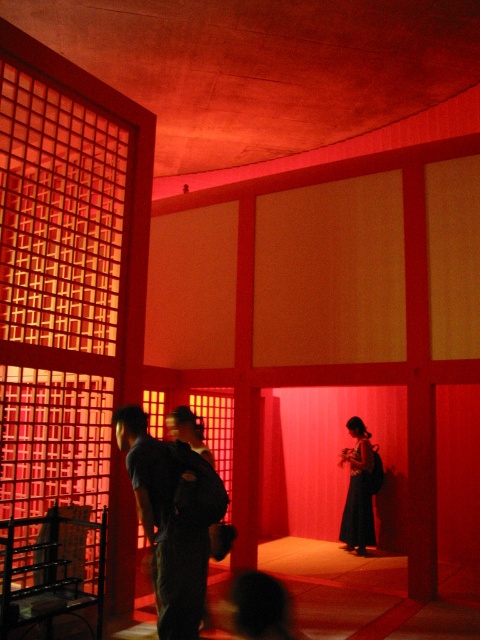
You are standing at the point labeled point (x=196, y=588). You want to walk straight to the sliding doors. How far will you have to walk?

The distance between the point labeled point (x=196, y=588) and the sliding doors is 3.32 meters, so you will have to walk 3.32 meters to reach the sliding doors.

You are organizing a small event in this red room and need to place both the dark blue fabric backpack at center and the black silk dress at center on a shelf. The shelf has limited space. Which object should you place first to ensure both fit?

The dark blue fabric backpack at center is bigger than the black silk dress at center, so you should place the dark blue fabric backpack at center first to ensure both fit on the shelf.